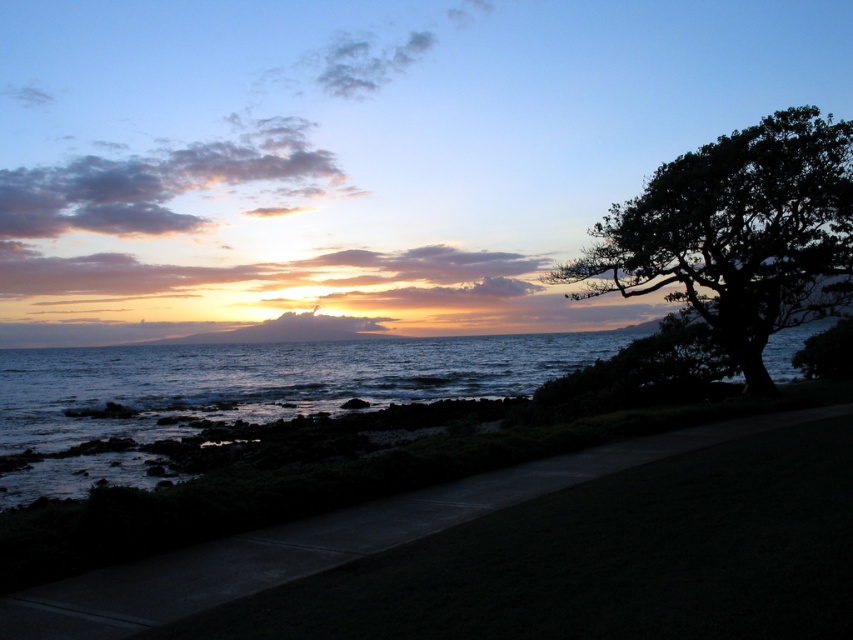
Locate an element on the screen. dark blue water at center is located at coordinates (265, 380).

Does point (463, 392) come in front of point (817, 316)?

That is False.

Locate an element on the screen. dark blue water at center is located at coordinates (265, 380).

The image size is (853, 640). What are the coordinates of `dark blue water at center` in the screenshot? It's located at (265, 380).